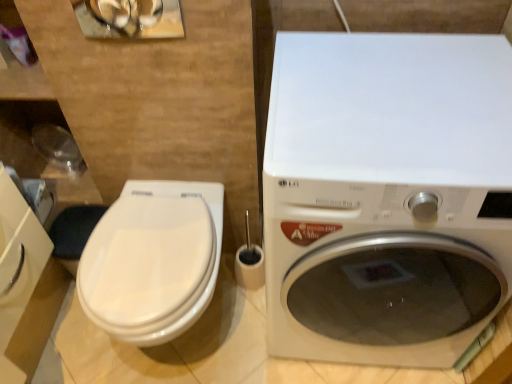
Question: Is point (488, 100) closer or farther from the camera than point (91, 241)?

Choices:
 (A) farther
 (B) closer

Answer: (B)

Question: Is white glossy washing machine at right inside the boundaries of white glossy toilet at left, or outside?

Choices:
 (A) inside
 (B) outside

Answer: (B)

Question: In the image, is white glossy washing machine at right positioned in front of or behind white glossy toilet at left?

Choices:
 (A) behind
 (B) front

Answer: (B)

Question: From a real-world perspective, is white glossy toilet at left physically located above or below white glossy washing machine at right?

Choices:
 (A) above
 (B) below

Answer: (B)

Question: In the image, is white glossy toilet at left on the left side or the right side of white glossy washing machine at right?

Choices:
 (A) left
 (B) right

Answer: (A)

Question: In terms of height, does white glossy toilet at left look taller or shorter compared to white glossy washing machine at right?

Choices:
 (A) tall
 (B) short

Answer: (B)

Question: Which is correct: white glossy toilet at left is inside white glossy washing machine at right, or outside of it?

Choices:
 (A) outside
 (B) inside

Answer: (A)